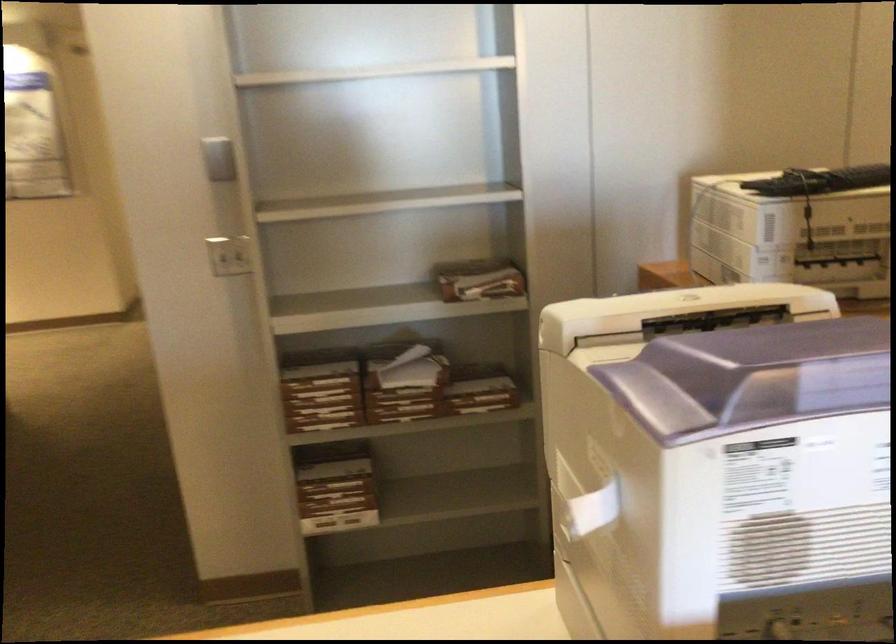
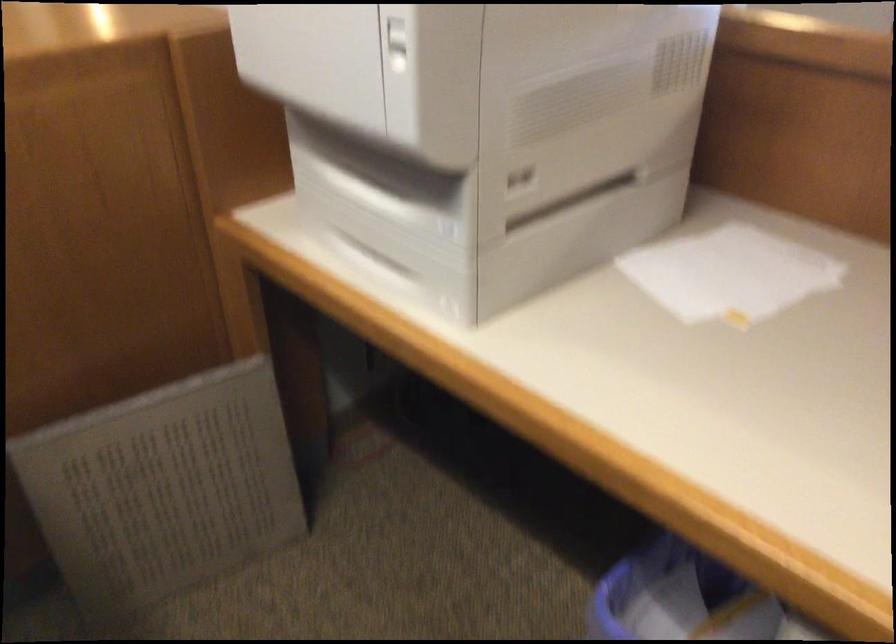
Where in the second image is the point corresponding to point 567,395 from the first image?

(397, 44)